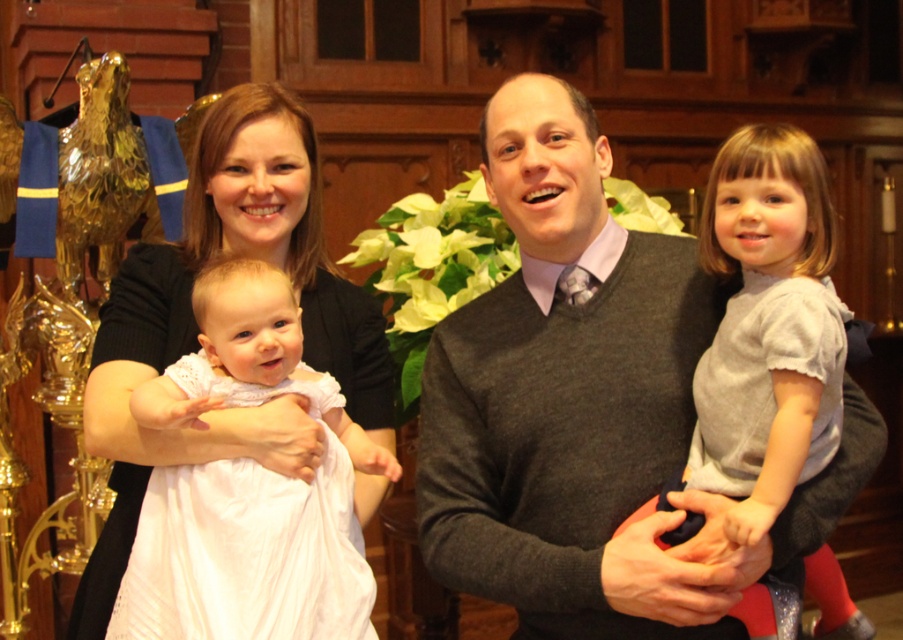
You are standing in the church and see the gray sweater at center. If you want to hand the man a book that is 1.5 meters long, can you reach him without moving closer?

The gray sweater at center is 3.15 meters away from the viewer. Since the book is 1.5 meters long, you can extend it to reach the man as the distance is within the book length.

You are a photographer setting up for a family portrait. The family is currently positioned with the black matte dress at center and the gray cotton dress at right. You need to adjust their positions so that they are exactly 6 feet apart for the shot. Based on their current distance, should you move them closer together or farther apart?

The current distance between the black matte dress at center and the gray cotton dress at right is 5.85 feet. Since 5.85 feet is less than 6 feet, you should move them slightly farther apart to achieve the desired 6 feet distance.